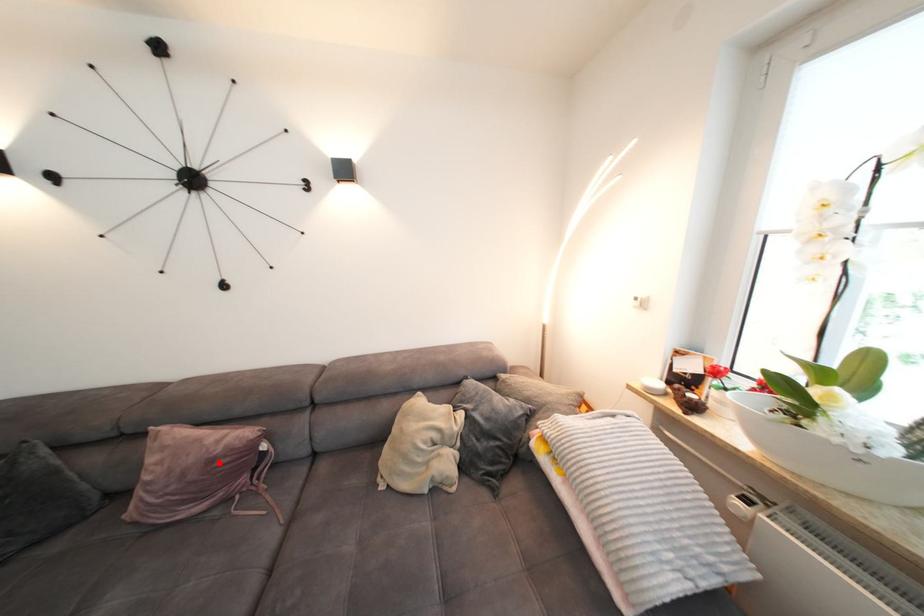
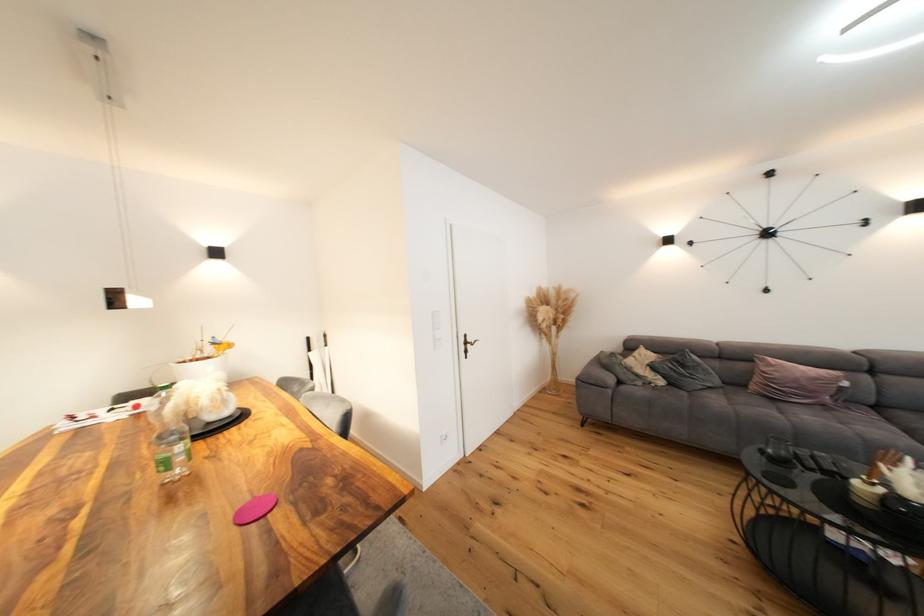
Question: I am providing you with two images of the same scene from different viewpoints. In image1, a red point is highlighted. Considering the same 3D point in image2, which of the following is correct?

Choices:
 (A) It is closer
 (B) It is farther

Answer: (A)